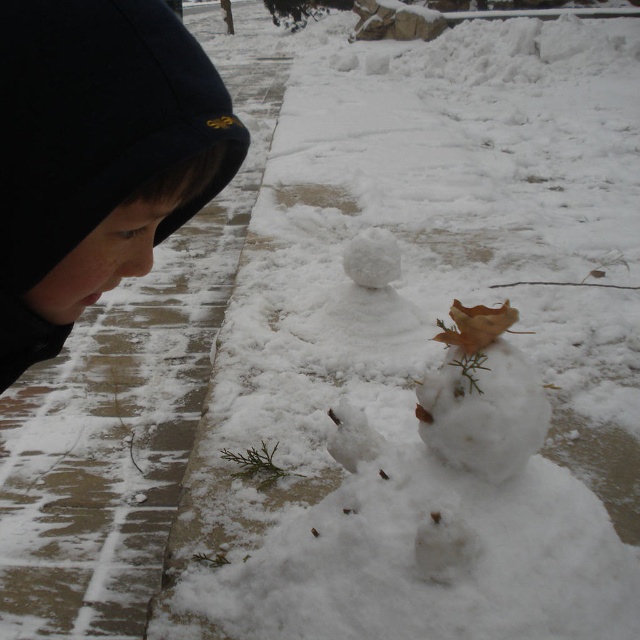
Question: Which point is closer to the camera taking this photo?

Choices:
 (A) (200, 88)
 (B) (500, 307)

Answer: (A)

Question: Is black fleece at upper left below brown leafy snowman at center?

Choices:
 (A) yes
 (B) no

Answer: (B)

Question: Does black fleece at upper left lie in front of brown leafy snowman at center?

Choices:
 (A) no
 (B) yes

Answer: (B)

Question: Does black fleece at upper left have a larger size compared to brown leafy snowman at center?

Choices:
 (A) yes
 (B) no

Answer: (A)